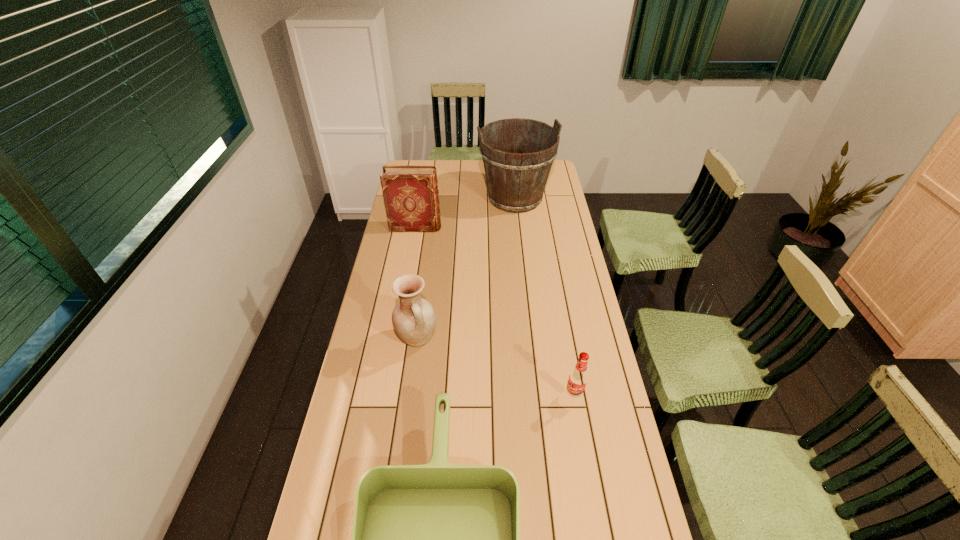
I want to click on empty space that is in between the tallest object and the root beer, so click(x=544, y=297).

You are a GUI agent. You are given a task and a screenshot of the screen. Output one action in this format:
    pyautogui.click(x=<x>, y=<y>)
    Task: Click on the vacant area that lies between the root beer and the farthest object
    
    Given the screenshot: What is the action you would take?
    pyautogui.click(x=544, y=297)

You are a GUI agent. You are given a task and a screenshot of the screen. Output one action in this format:
    pyautogui.click(x=<x>, y=<y>)
    Task: Click on the empty space between the second shortest object and the third farthest object
    The image size is (960, 540).
    Given the screenshot: What is the action you would take?
    pyautogui.click(x=495, y=367)

Locate an element on the screen. The image size is (960, 540). free space that is in between the third farthest object and the farthest object is located at coordinates (466, 269).

You are a GUI agent. You are given a task and a screenshot of the screen. Output one action in this format:
    pyautogui.click(x=<x>, y=<y>)
    Task: Click on the vacant area that lies between the second farthest object and the second nearest object
    This screenshot has width=960, height=540.
    Given the screenshot: What is the action you would take?
    pyautogui.click(x=495, y=312)

Find the location of a particular element. object that is the second closest to the pottery is located at coordinates (578, 378).

The image size is (960, 540). Find the location of `object identified as the closest to the third nearest object`. object identified as the closest to the third nearest object is located at coordinates (438, 539).

Where is `blank area in the image that satisfies the following two spatial constraints: 1. on the spine side of the second farthest object; 2. on the back side of the pottery`? This screenshot has height=540, width=960. blank area in the image that satisfies the following two spatial constraints: 1. on the spine side of the second farthest object; 2. on the back side of the pottery is located at coordinates (396, 339).

The width and height of the screenshot is (960, 540). What are the coordinates of `vacant space that satisfies the following two spatial constraints: 1. on the spine side of the third farthest object; 2. on the right side of the second farthest object` in the screenshot? It's located at (396, 339).

I want to click on free space in the image that satisfies the following two spatial constraints: 1. on the spine side of the third nearest object; 2. on the left side of the hardback book, so click(396, 339).